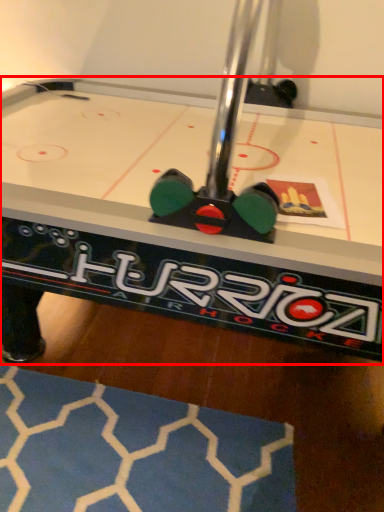
Question: From the image's perspective, what is the correct spatial relationship of table (annotated by the red box) in relation to mat?

Choices:
 (A) above
 (B) below

Answer: (A)